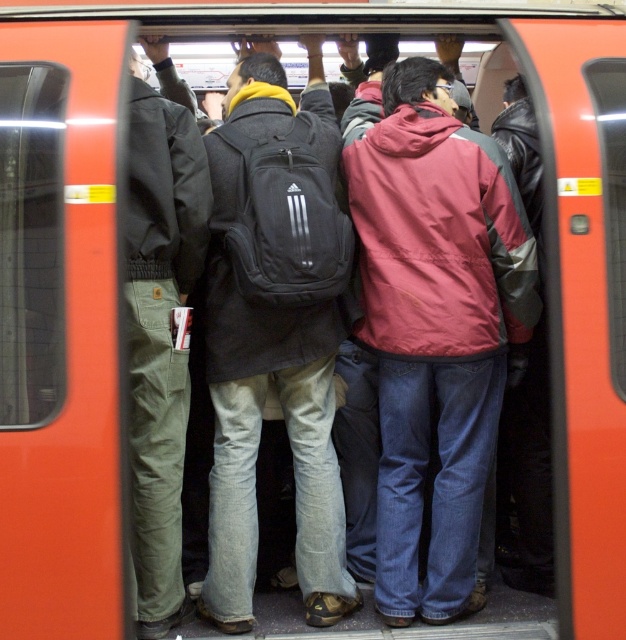
Question: Among these points, which one is farthest from the camera?

Choices:
 (A) (155, 173)
 (B) (337, 163)

Answer: (B)

Question: Which object appears farthest from the camera in this image?

Choices:
 (A) black fabric backpack at center
 (B) red nylon jacket at center

Answer: (B)

Question: Does red nylon jacket at center appear on the right side of olive green corduroy pants at left?

Choices:
 (A) yes
 (B) no

Answer: (A)

Question: Does red nylon jacket at center appear on the left side of olive green corduroy pants at left?

Choices:
 (A) yes
 (B) no

Answer: (B)

Question: Is black fabric backpack at center positioned in front of olive green corduroy pants at left?

Choices:
 (A) no
 (B) yes

Answer: (A)

Question: Which object is closer to the camera taking this photo?

Choices:
 (A) black fabric backpack at center
 (B) olive green corduroy pants at left

Answer: (B)